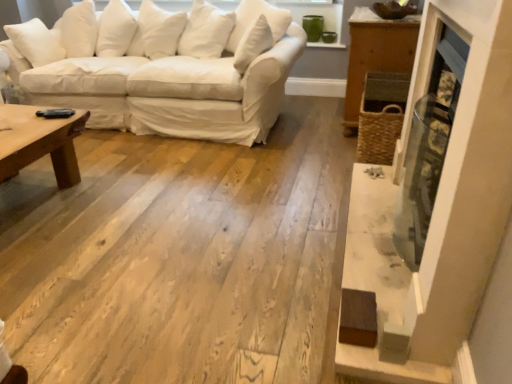
The width and height of the screenshot is (512, 384). What do you see at coordinates (428, 146) in the screenshot? I see `metallic glass fireplace at right` at bounding box center [428, 146].

This screenshot has width=512, height=384. Find the location of `metallic glass fireplace at right`. metallic glass fireplace at right is located at coordinates (428, 146).

Image resolution: width=512 pixels, height=384 pixels. Describe the element at coordinates (163, 68) in the screenshot. I see `white cotton couch at upper left` at that location.

Identify the location of white cotton couch at upper left. Image resolution: width=512 pixels, height=384 pixels. (163, 68).

Where is `metallic glass fireplace at right`? Image resolution: width=512 pixels, height=384 pixels. metallic glass fireplace at right is located at coordinates (428, 146).

Which is more to the left, white cotton couch at upper left or metallic glass fireplace at right?

white cotton couch at upper left is more to the left.

In the image, is white cotton couch at upper left positioned in front of or behind metallic glass fireplace at right?

In the image, white cotton couch at upper left appears behind metallic glass fireplace at right.

Is point (75, 66) in front of point (425, 154)?

No, it is behind (425, 154).

From the image's perspective, is white cotton couch at upper left located beneath metallic glass fireplace at right?

Incorrect, from the image's perspective, white cotton couch at upper left is higher than metallic glass fireplace at right.

From a real-world perspective, which is physically below, white cotton couch at upper left or metallic glass fireplace at right?

In real-world perspective, white cotton couch at upper left is lower.

Does white cotton couch at upper left have a greater width compared to metallic glass fireplace at right?

Yes, white cotton couch at upper left is wider than metallic glass fireplace at right.

Looking at this image, considering the relative sizes of white cotton couch at upper left and metallic glass fireplace at right in the image provided, is white cotton couch at upper left taller than metallic glass fireplace at right?

No, white cotton couch at upper left is not taller than metallic glass fireplace at right.

Can you confirm if white cotton couch at upper left is bigger than metallic glass fireplace at right?

Yes, white cotton couch at upper left is bigger than metallic glass fireplace at right.

Is metallic glass fireplace at right surrounded by white cotton couch at upper left?

That's incorrect, metallic glass fireplace at right is not inside white cotton couch at upper left.

Is white cotton couch at upper left with metallic glass fireplace at right?

No, white cotton couch at upper left is not making contact with metallic glass fireplace at right.

Is metallic glass fireplace at right at the back of white cotton couch at upper left?

No.

How different are the orientations of white cotton couch at upper left and metallic glass fireplace at right in degrees?

They differ by 90.4 degrees in their facing directions.

This screenshot has height=384, width=512. Identify the location of studio couch below the metallic glass fireplace at right (from a real-world perspective). [x=163, y=68].

Considering the relative positions of metallic glass fireplace at right and white cotton couch at upper left in the image provided, is metallic glass fireplace at right to the right of white cotton couch at upper left from the viewer's perspective?

Yes, metallic glass fireplace at right is to the right of white cotton couch at upper left.

From the picture: Is metallic glass fireplace at right positioned in front of white cotton couch at upper left?

Yes, metallic glass fireplace at right is closer to the viewer.

Considering the positions of point (416, 235) and point (267, 26), is point (416, 235) closer or farther from the camera than point (267, 26)?

Point (416, 235) appears to be closer to the viewer than point (267, 26).

From the image's perspective, which one is positioned lower, metallic glass fireplace at right or white cotton couch at upper left?

metallic glass fireplace at right is shown below in the image.

Based on the photo, from a real-world perspective, between metallic glass fireplace at right and white cotton couch at upper left, who is vertically lower?

white cotton couch at upper left.

Considering the relative sizes of metallic glass fireplace at right and white cotton couch at upper left in the image provided, is metallic glass fireplace at right wider than white cotton couch at upper left?

No.

In terms of height, does metallic glass fireplace at right look taller or shorter compared to white cotton couch at upper left?

Clearly, metallic glass fireplace at right is taller compared to white cotton couch at upper left.

Is metallic glass fireplace at right smaller than white cotton couch at upper left?

Indeed, metallic glass fireplace at right has a smaller size compared to white cotton couch at upper left.

Can white cotton couch at upper left be found inside metallic glass fireplace at right?

Actually, white cotton couch at upper left is outside metallic glass fireplace at right.

Are metallic glass fireplace at right and white cotton couch at upper left making contact?

metallic glass fireplace at right is not next to white cotton couch at upper left, and they're not touching.

Is white cotton couch at upper left at the back of metallic glass fireplace at right?

metallic glass fireplace at right is not turned away from white cotton couch at upper left.

In order to click on fireplace above the white cotton couch at upper left (from a real-world perspective) in this screenshot , I will do `click(428, 146)`.

Locate an element on the screen. The width and height of the screenshot is (512, 384). fireplace that is in front of the white cotton couch at upper left is located at coordinates (428, 146).

You are a GUI agent. You are given a task and a screenshot of the screen. Output one action in this format:
    pyautogui.click(x=<x>, y=<y>)
    Task: Click on the fireplace on the right of white cotton couch at upper left
    The height and width of the screenshot is (384, 512).
    Given the screenshot: What is the action you would take?
    pyautogui.click(x=428, y=146)